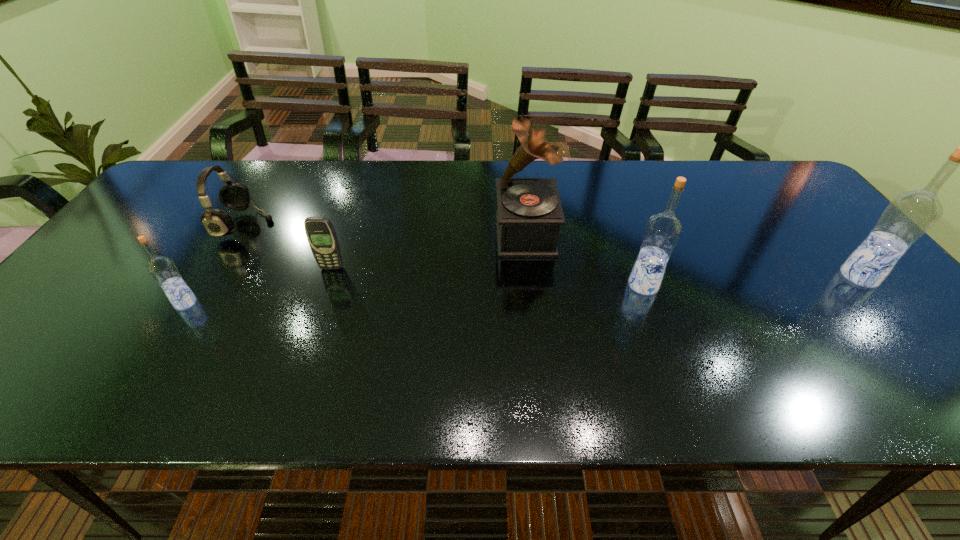
Locate which object is the closest to the headset. Please provide its 2D coordinates. Your answer should be formatted as a tuple, i.e. [(x, y)], where the tuple contains the x and y coordinates of a point satisfying the conditions above.

[(162, 269)]

The image size is (960, 540). Find the location of `the third closest object to the second tallest vodka`. the third closest object to the second tallest vodka is located at coordinates (320, 233).

Where is `the closest vodka to the third object from right to left`? the closest vodka to the third object from right to left is located at coordinates (662, 232).

This screenshot has height=540, width=960. Find the location of `the second closest vodka relative to the leftmost vodka`. the second closest vodka relative to the leftmost vodka is located at coordinates (909, 215).

The image size is (960, 540). I want to click on vacant space that satisfies the following two spatial constraints: 1. on the back side of the second object from right to left; 2. on the right side of the rightmost vodka, so click(640, 276).

The height and width of the screenshot is (540, 960). I want to click on free space that satisfies the following two spatial constraints: 1. at the horn opening of the third object from right to left; 2. on the left side of the rightmost object, so click(x=531, y=276).

Where is `free space that satisfies the following two spatial constraints: 1. with the microphone on the side of the second vodka from right to left; 2. on the right side of the headset`? This screenshot has width=960, height=540. free space that satisfies the following two spatial constraints: 1. with the microphone on the side of the second vodka from right to left; 2. on the right side of the headset is located at coordinates (209, 285).

I want to click on free location that satisfies the following two spatial constraints: 1. with the microphone on the side of the headset; 2. on the back side of the rightmost vodka, so click(x=214, y=276).

I want to click on vacant region that satisfies the following two spatial constraints: 1. on the back side of the second vodka from left to right; 2. on the left side of the rightmost vodka, so pos(640,276).

Locate an element on the screen. vacant space that satisfies the following two spatial constraints: 1. on the screen of the second vodka from left to right; 2. on the right side of the cellular telephone is located at coordinates (325, 285).